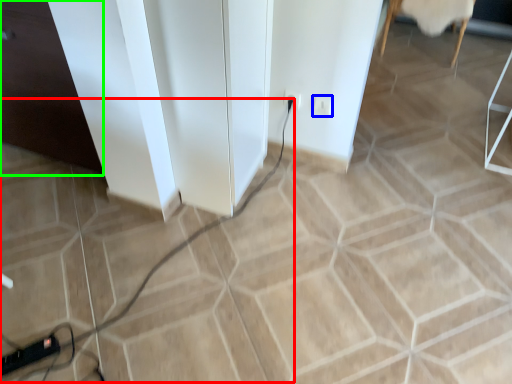
Question: Estimate the real-world distances between objects in this image. Which object is closer to cable (highlighted by a red box), socket (highlighted by a blue box) or file cabinet (highlighted by a green box)?

Choices:
 (A) socket
 (B) file cabinet

Answer: (A)